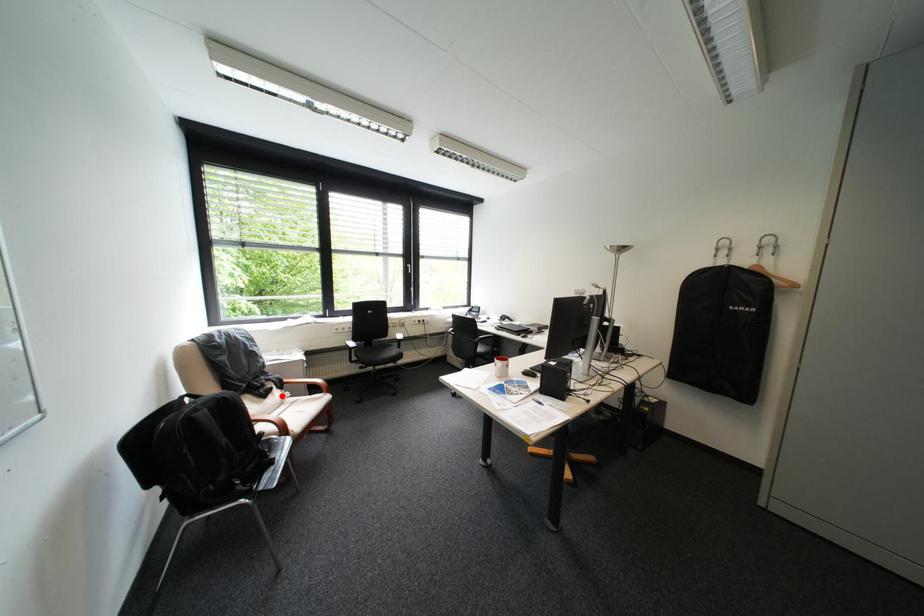
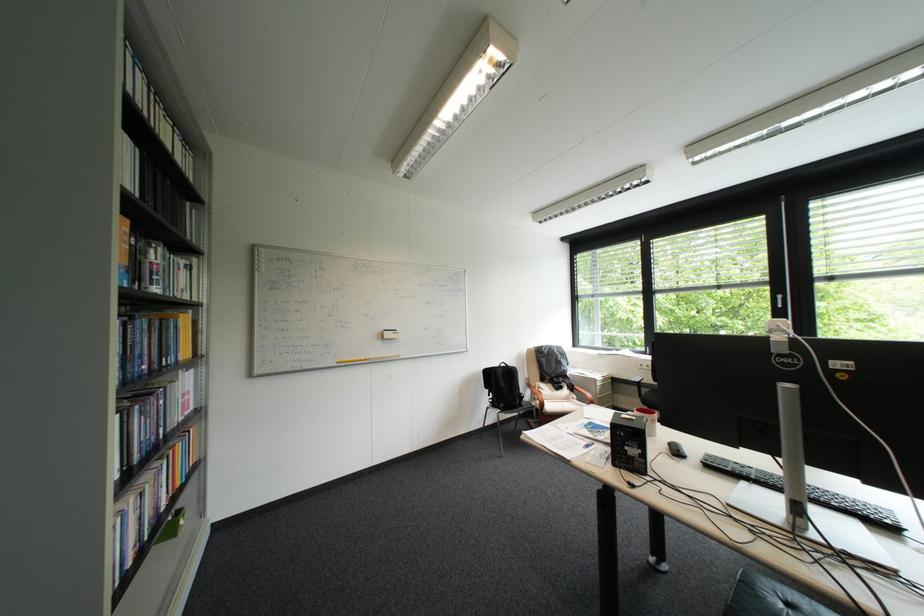
In the second image, find the point that corresponds to the highlighted location in the first image.

(573, 391)